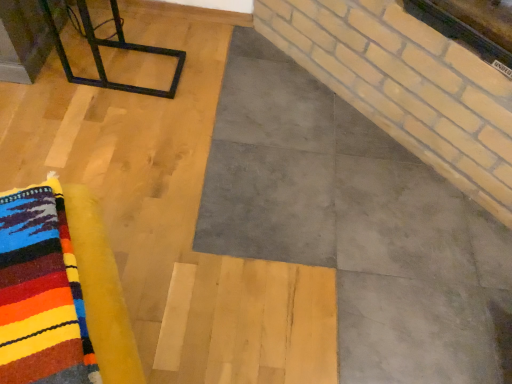
Question: From the image's perspective, is black metal frame at upper left above or below multicolored wool rug at lower left?

Choices:
 (A) above
 (B) below

Answer: (A)

Question: Is black metal frame at upper left situated inside multicolored wool rug at lower left or outside?

Choices:
 (A) outside
 (B) inside

Answer: (A)

Question: Is black metal frame at upper left taller or shorter than multicolored wool rug at lower left?

Choices:
 (A) tall
 (B) short

Answer: (B)

Question: In terms of height, does multicolored wool rug at lower left look taller or shorter compared to black metal frame at upper left?

Choices:
 (A) short
 (B) tall

Answer: (B)

Question: Relative to black metal frame at upper left, is multicolored wool rug at lower left in front or behind?

Choices:
 (A) behind
 (B) front

Answer: (B)

Question: Visually, is multicolored wool rug at lower left positioned to the left or to the right of black metal frame at upper left?

Choices:
 (A) left
 (B) right

Answer: (B)

Question: From a real-world perspective, is multicolored wool rug at lower left physically located above or below black metal frame at upper left?

Choices:
 (A) above
 (B) below

Answer: (A)